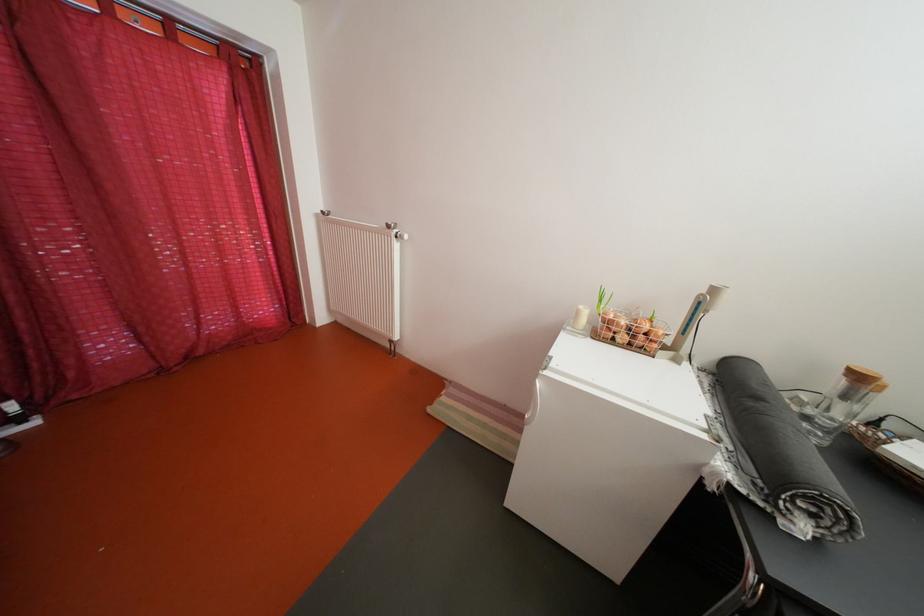
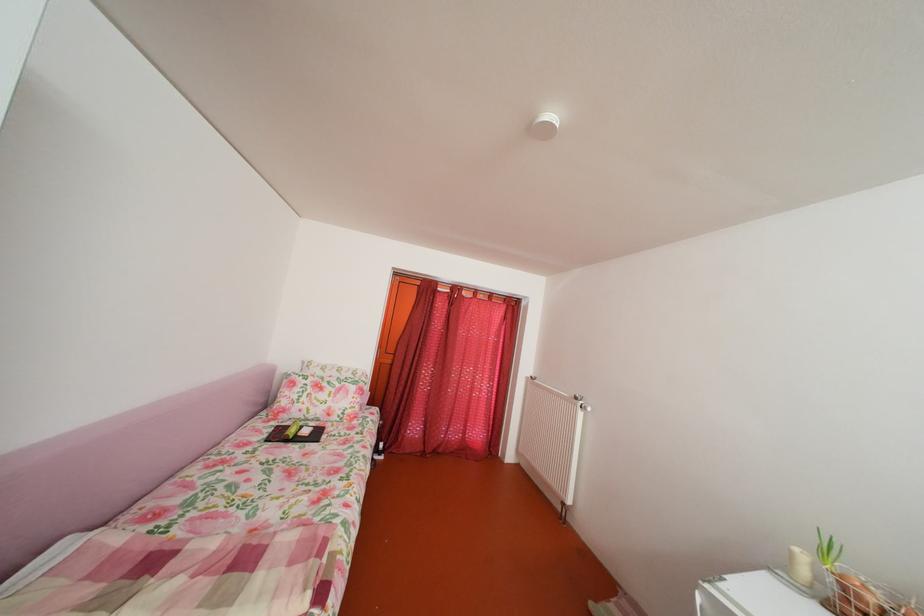
In the second image, find the point that corresponds to (629,331) in the first image.

(871, 605)